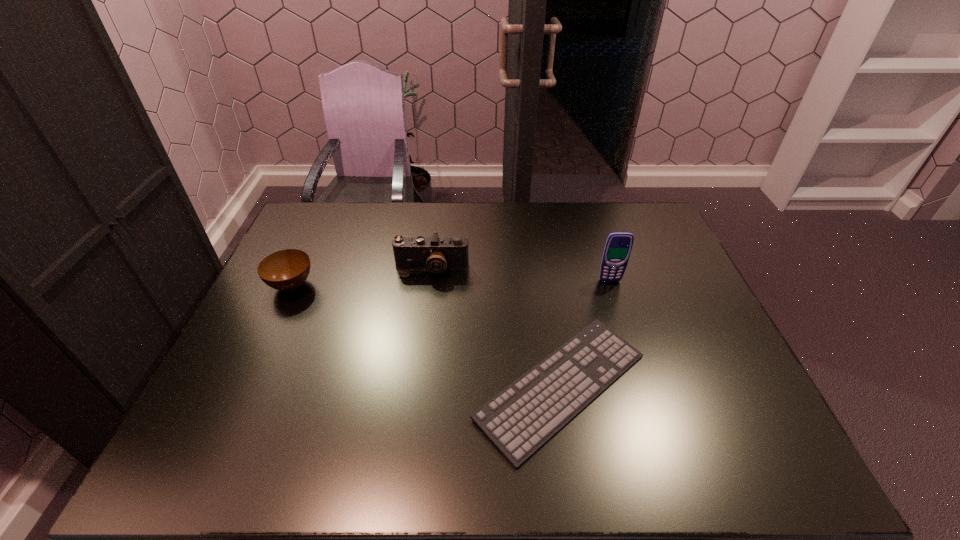
At what (x,y) coordinates should I click in order to perform the action: click on vacant space located 0.290m on the left of the nearest object. Please return your answer as a coordinate pair (x, y). Looking at the image, I should click on (349, 387).

You are a GUI agent. You are given a task and a screenshot of the screen. Output one action in this format:
    pyautogui.click(x=<x>, y=<y>)
    Task: Click on the object that is at the near edge
    Image resolution: width=960 pixels, height=540 pixels.
    Given the screenshot: What is the action you would take?
    pyautogui.click(x=519, y=420)

In order to click on object located at the left edge in this screenshot , I will do `click(285, 270)`.

Find the location of a particular element. The width and height of the screenshot is (960, 540). vacant space at the far edge of the desktop is located at coordinates (452, 204).

Image resolution: width=960 pixels, height=540 pixels. Find the location of `blank area at the near edge`. blank area at the near edge is located at coordinates pos(668,455).

Where is `vacant space at the left edge of the desktop`? vacant space at the left edge of the desktop is located at coordinates (224, 399).

Locate an element on the screen. The width and height of the screenshot is (960, 540). vacant space at the right edge of the desktop is located at coordinates (664, 312).

Find the location of a particular element. This screenshot has width=960, height=540. blank space at the near left corner is located at coordinates (238, 453).

In the image, there is a desktop. Where is `vacant space at the far right corner`? This screenshot has height=540, width=960. vacant space at the far right corner is located at coordinates (657, 218).

Where is `unoccupied area between the second tallest object and the cellular telephone`? unoccupied area between the second tallest object and the cellular telephone is located at coordinates (521, 275).